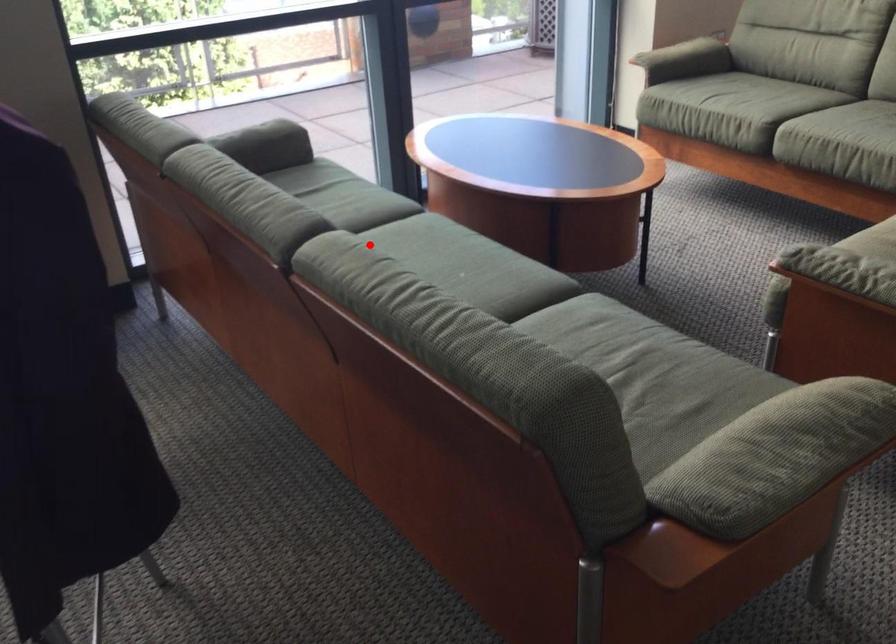
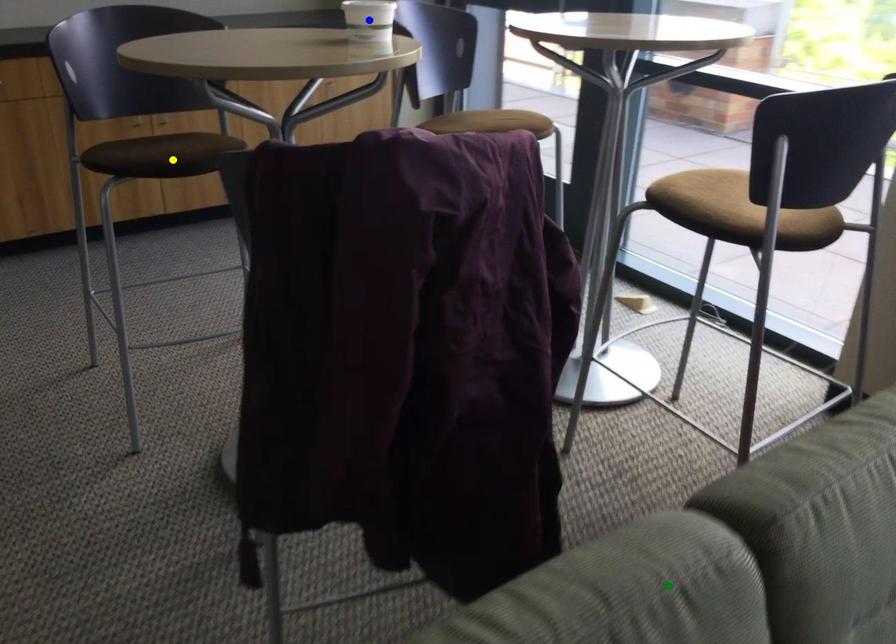
Question: I am providing you with two images of the same scene from different viewpoints. A red point is marked on the first image. You are given multiple points on the second image. Which spot in image 2 lines up with the point in image 1?

Choices:
 (A) blue point
 (B) green point
 (C) yellow point

Answer: (B)